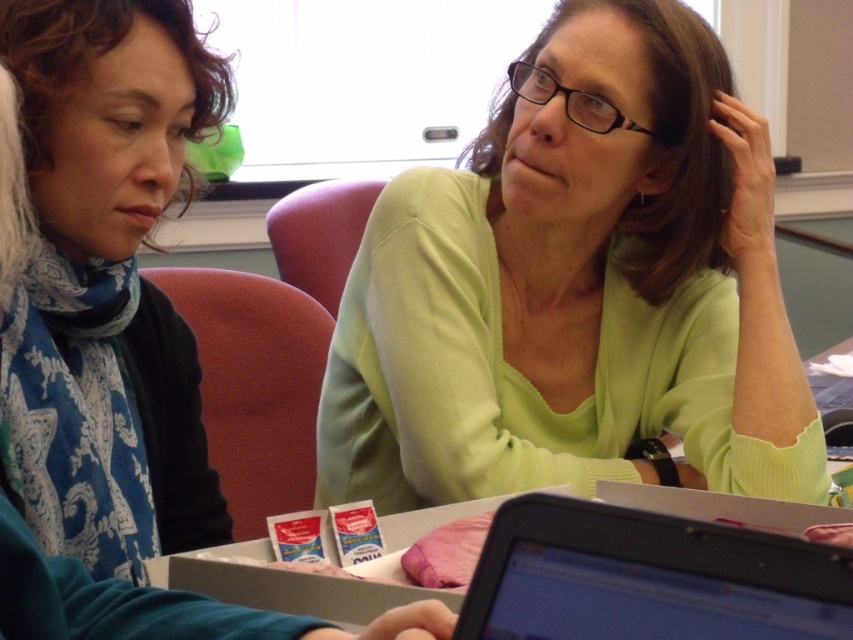
What is the color of the object at point (109, 333)?

The object at point (109, 333) is part of the matte green sweater at center.

You are an interior designer assessing the spatial arrangement of the classroom. The two objects in focus are the green matte sweater at center and the matte green sweater at center. Which one is taller?

The green matte sweater at center is much taller than the matte green sweater at center according to the description.